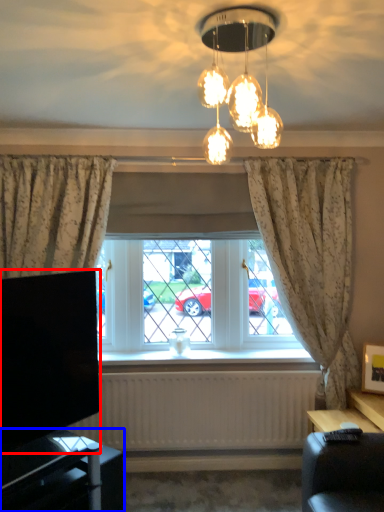
Question: Which point is further to the camera, television (highlighted by a red box) or furniture (highlighted by a blue box)?

Choices:
 (A) television
 (B) furniture

Answer: (A)